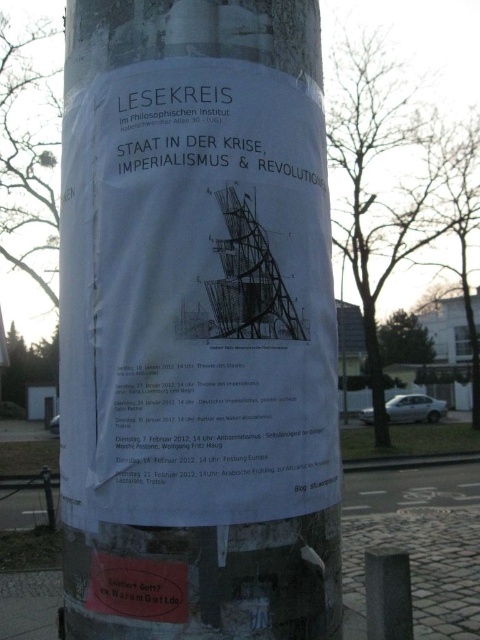
You are a painter standing 2 meters away from the white paper poster at center. You want to paint the black stone post at lower right without moving. Is it possible to reach the post with your paintbrush?

The distance between the white paper poster at center and the black stone post at lower right is 3.65 meters. Since you are already 2 meters away from the poster, the total distance to the post would be 2 meters plus 3.65 meters, totaling 5.65 meters. Unless you have an extremely long paintbrush, it is unlikely you can reach the post without moving closer.

You are standing in front of the cylindrical pole and want to read the white paper poster at center. Is the poster positioned above or below the black stone post at lower right?

The white paper poster at center is located above the black stone post at lower right.

You are a delivery person trying to attach a parcel to the pole. The parcel is the same size as the black stone post at lower right. Can you fit the parcel next to the white paper poster at center without overlapping?

The white paper poster at center is larger in size than the black stone post at lower right. Since the parcel is the same size as the black stone post at lower right, there should be enough space to attach it next to the white paper poster at center without overlapping.